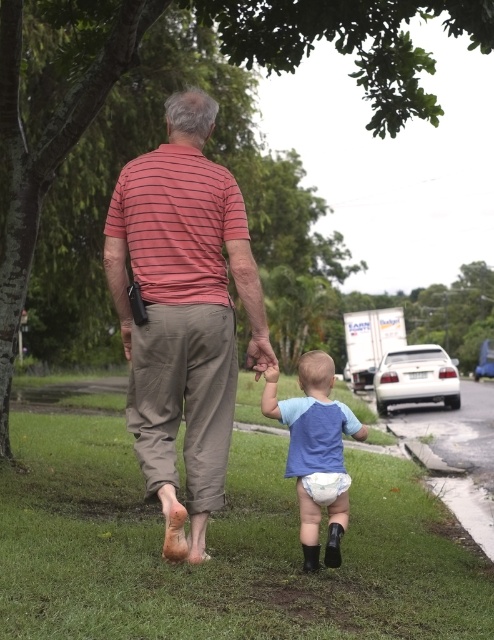
Question: Based on their relative distances, which object is farther from the white cloth diaper at lower center?

Choices:
 (A) green grass at lower center
 (B) blue fabric diaper at lower center
 (C) striped cotton shirt at center

Answer: (A)

Question: Is striped cotton shirt at center closer to the viewer compared to blue fabric diaper at lower center?

Choices:
 (A) yes
 (B) no

Answer: (A)

Question: Among these objects, which one is nearest to the camera?

Choices:
 (A) green grass at lower center
 (B) white cloth diaper at lower center

Answer: (A)

Question: Observing the image, what is the correct spatial positioning of green grass at lower center in reference to striped cotton shirt at center?

Choices:
 (A) below
 (B) above

Answer: (A)

Question: Which object is positioned closest to the striped cotton shirt at center?

Choices:
 (A) white cloth diaper at lower center
 (B) green grass at lower center

Answer: (A)

Question: Is green grass at lower center positioned at the back of blue fabric diaper at lower center?

Choices:
 (A) no
 (B) yes

Answer: (A)